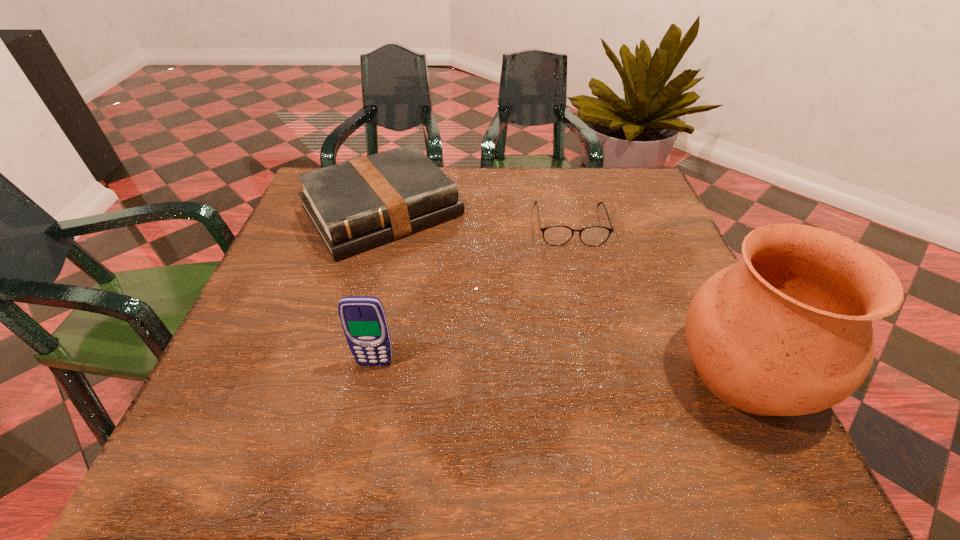
Locate an element on the screen. The width and height of the screenshot is (960, 540). free area in between the spectacles and the rightmost object is located at coordinates (658, 299).

I want to click on free space between the cellular telephone and the spectacles, so click(x=472, y=294).

This screenshot has width=960, height=540. Identify the location of vacant area that lies between the cellular telephone and the tallest object. (560, 368).

What are the coordinates of `free space that is in between the third shortest object and the pottery` in the screenshot? It's located at (560, 368).

At what (x,y) coordinates should I click in order to perform the action: click on free space between the spectacles and the cellular telephone. Please return your answer as a coordinate pair (x, y). Looking at the image, I should click on (472, 294).

At what (x,y) coordinates should I click in order to perform the action: click on vacant space that is in between the third object from left to right and the hardback book. Please return your answer as a coordinate pair (x, y). This screenshot has width=960, height=540. Looking at the image, I should click on (476, 218).

The height and width of the screenshot is (540, 960). What are the coordinates of `vacant point located between the second object from right to left and the tallest object` in the screenshot? It's located at (658, 299).

Locate an element on the screen. vacant area that lies between the second tallest object and the tallest object is located at coordinates (560, 368).

I want to click on object that is the third closest to the hardback book, so click(787, 331).

Identify the location of object that can be found as the third closest to the hardback book. (787, 331).